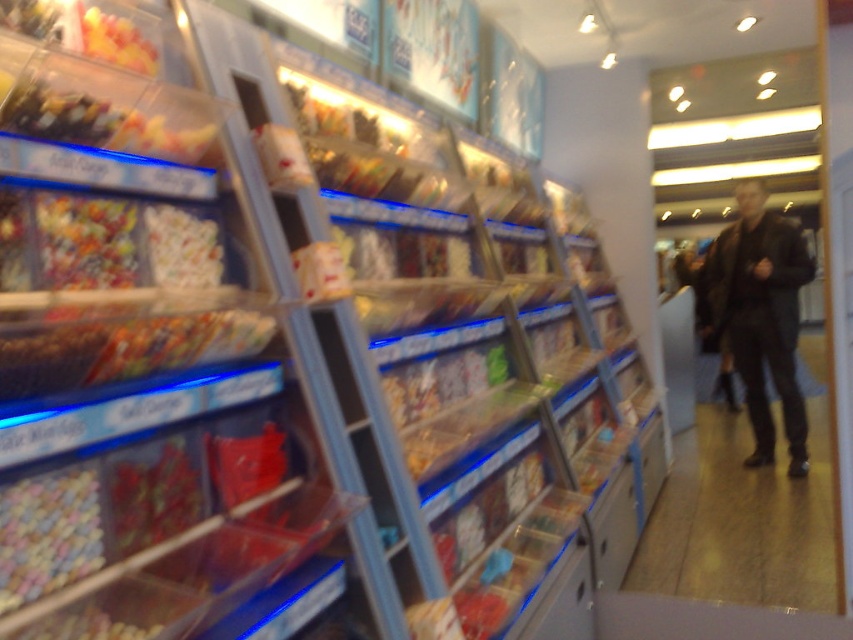
You are standing at the entrance of the candy store and see the black leather pants at lower right. Where exactly are they located in the store?

The black leather pants at lower right are located at point (741, 518) in the store.

You are a customer in the candy store and want to place a small gift box on the floor near the dark brown leather jacket at right. Can you confirm if the gift box will be placed on the pastel mosaic tiles at lower left?

The dark brown leather jacket at right is above pastel mosaic tiles at lower left, so placing the gift box near the dark brown leather jacket at right would place it on the pastel mosaic tiles at lower left.